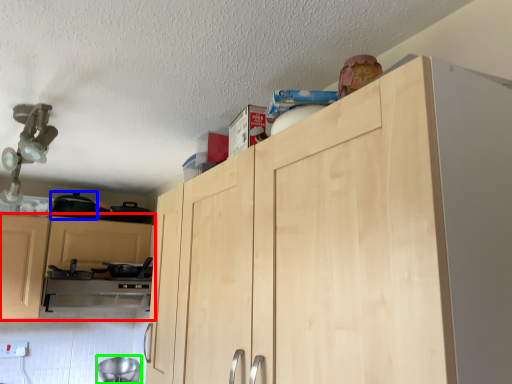
Question: Which is nearer to the cabinetry (highlighted by a red box)? appliance (highlighted by a blue box) or appliance (highlighted by a green box).

Choices:
 (A) appliance
 (B) appliance

Answer: (A)